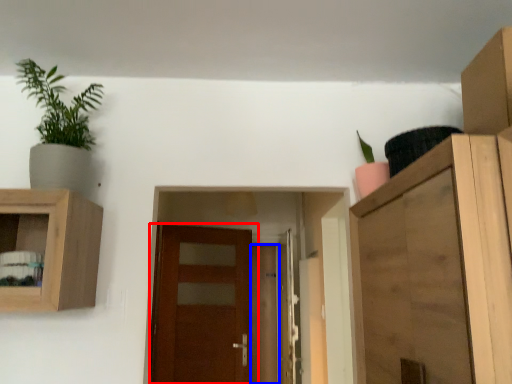
Question: Which point is closer to the camera, door (highlighted by a red box) or door (highlighted by a blue box)?

Choices:
 (A) door
 (B) door

Answer: (A)